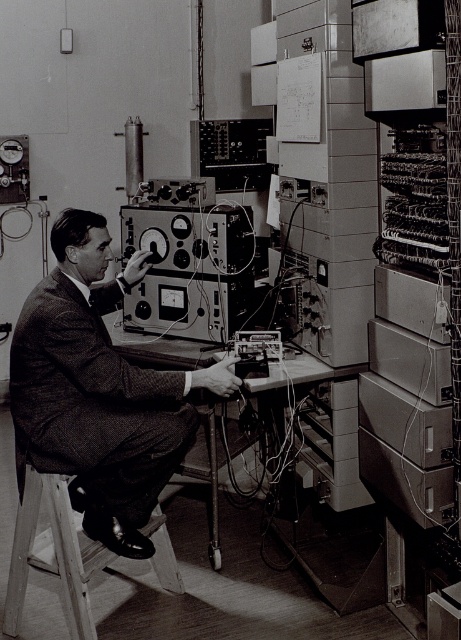
Does textured wool suit at center have a larger size compared to wooden stool at lower left?

Indeed, textured wool suit at center has a larger size compared to wooden stool at lower left.

Can you confirm if textured wool suit at center is positioned below wooden stool at lower left?

Actually, textured wool suit at center is above wooden stool at lower left.

I want to click on textured wool suit at center, so click(94, 401).